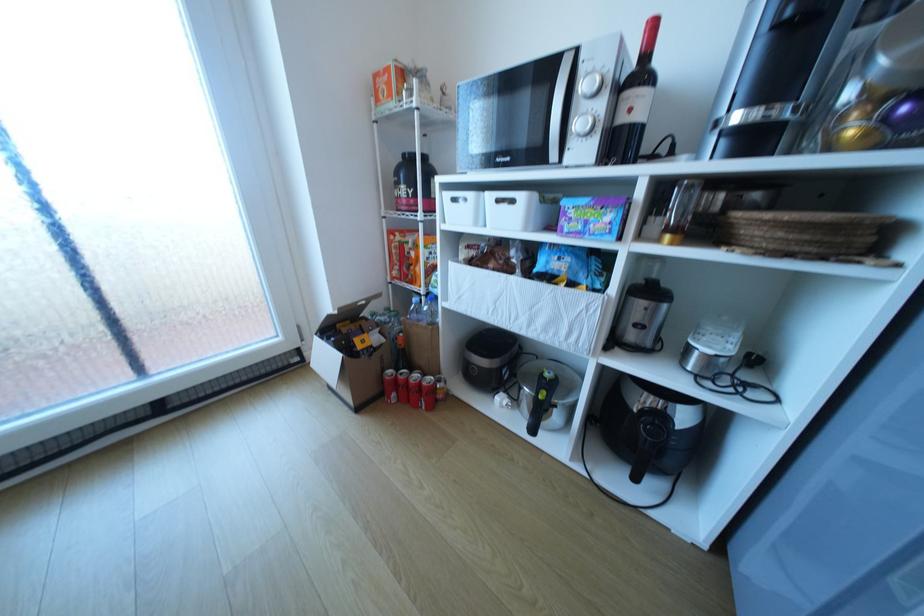
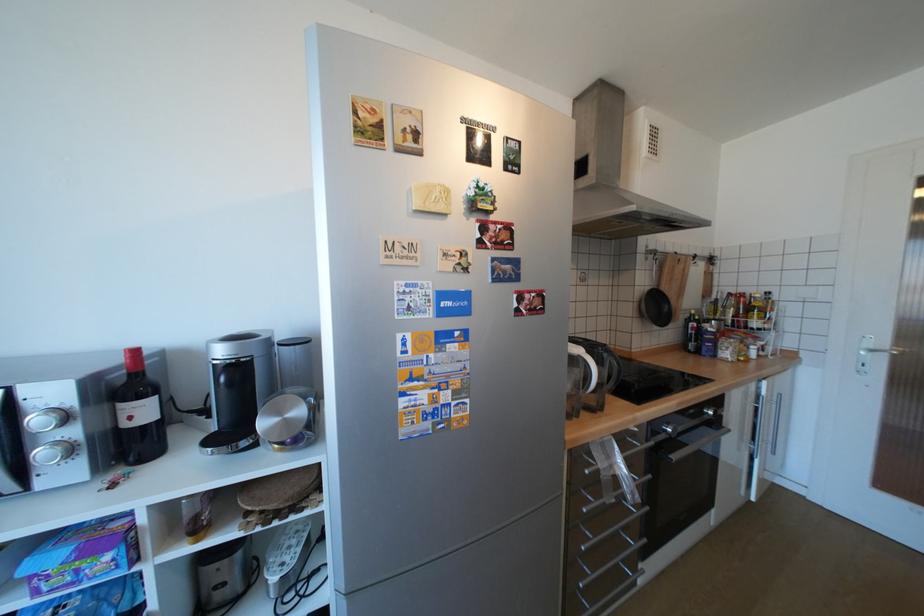
In the second image, find the point that corresponds to point 590,227 in the first image.

(79, 578)